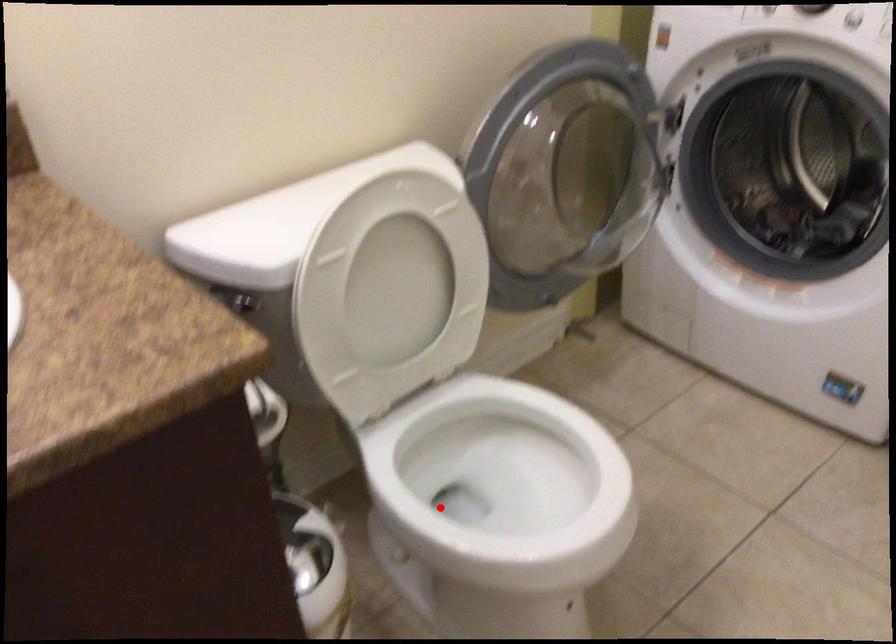
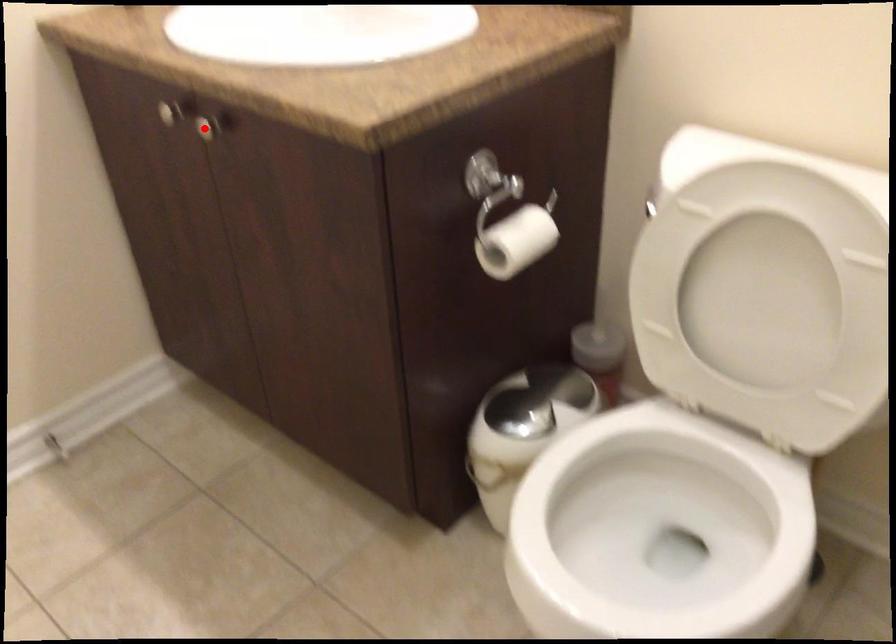
I am providing you with two images of the same scene from different viewpoints. A red point is marked on the first image and another point is marked on the second image. Is the marked point in image1 the same physical position as the marked point in image2?

No